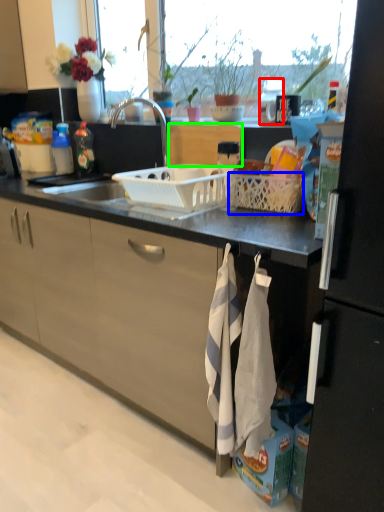
Question: Which is nearer to the appliance (highlighted by a red box)? basket (highlighted by a blue box) or cabinetry (highlighted by a green box).

Choices:
 (A) basket
 (B) cabinetry

Answer: (B)